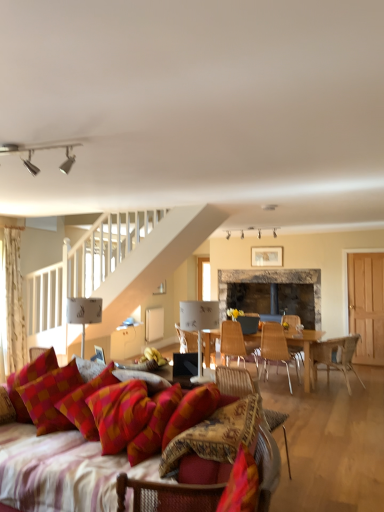
The width and height of the screenshot is (384, 512). What do you see at coordinates (41, 149) in the screenshot?
I see `silver metallic track lights at upper center, the 2th lamp viewed from the right` at bounding box center [41, 149].

This screenshot has height=512, width=384. I want to click on wooden chair at center, the fifth chair from the front, so click(x=235, y=341).

What do you see at coordinates (366, 305) in the screenshot? The height and width of the screenshot is (512, 384). I see `light brown wooden door at right` at bounding box center [366, 305].

Measure the distance between point (76,309) and camera.

Point (76,309) is 3.58 meters from camera.

What is the approximate height of plush fabric couch at lower left?

plush fabric couch at lower left is 28.42 inches in height.

The width and height of the screenshot is (384, 512). I want to click on silver metallic track lights at upper center, placed as the 3th lamp when sorted from back to front, so click(41, 149).

Considering the positions of objects rustic stone fireplace at center and wooden chair at center, the fifth chair from the front, in the image provided, who is more to the right, rustic stone fireplace at center or wooden chair at center, the fifth chair from the front,?

rustic stone fireplace at center is more to the right.

Who is taller, rustic stone fireplace at center or wooden chair at center, the fifth chair from the front?

rustic stone fireplace at center is taller.

What are the coordinates of `fireplace above the wooden chair at center, which is the second chair from back to front (from a real-world perspective)` in the screenshot? It's located at (269, 293).

Is rustic stone fireplace at center inside the boundaries of wooden chair at center, which is the second chair from back to front, or outside?

rustic stone fireplace at center is located beyond the bounds of wooden chair at center, which is the second chair from back to front.

Is white textured curtain at left inside white paper lampshade at upper left, the 1th lamp positioned from the back?

No, white textured curtain at left is not a part of white paper lampshade at upper left, the 1th lamp positioned from the back.

Looking at this image, can you confirm if white paper lampshade at upper left, the third lamp when ordered from front to back, is taller than white textured curtain at left?

No.

From the picture: From a real-world perspective, is white paper lampshade at upper left, which is the third lamp from right to left, beneath white textured curtain at left?

Yes, from a real-world perspective, white paper lampshade at upper left, which is the third lamp from right to left, is below white textured curtain at left.

How many degrees apart are the facing directions of white paper lampshade at upper left, the first lamp in the bottom-to-top sequence, and white textured curtain at left?

They differ by 86.9 degrees in their facing directions.

Is white paper lampshade at upper left, which is the third lamp from right to left, smaller than wooden chair at right, which appears as the 4th chair when viewed from the back?

Yes, white paper lampshade at upper left, which is the third lamp from right to left, is smaller than wooden chair at right, which appears as the 4th chair when viewed from the back.

From the image's perspective, is white paper lampshade at upper left, the third lamp from the top, located above or below wooden chair at right, which appears as the 3th chair when viewed from the front?

Based on their image positions, white paper lampshade at upper left, the third lamp from the top, is located above wooden chair at right, which appears as the 3th chair when viewed from the front.

How far apart are white paper lampshade at upper left, the first lamp in the bottom-to-top sequence, and wooden chair at right, which appears as the 3th chair when viewed from the front?

A distance of 3.49 meters exists between white paper lampshade at upper left, the first lamp in the bottom-to-top sequence, and wooden chair at right, which appears as the 3th chair when viewed from the front.

Is white paper lampshade at upper left, the 1th lamp positioned from the back, wider or thinner than wooden chair at right, which appears as the 4th chair when viewed from the back?

In the image, white paper lampshade at upper left, the 1th lamp positioned from the back, appears to be more narrow than wooden chair at right, which appears as the 4th chair when viewed from the back.

Considering the relative sizes of wooden chair at center, positioned as the 4th chair in front-to-back order, and rustic stone fireplace at center in the image provided, is wooden chair at center, positioned as the 4th chair in front-to-back order, bigger than rustic stone fireplace at center?

No.

In terms of width, does wooden chair at center, placed as the 3th chair when sorted from back to front, look wider or thinner when compared to rustic stone fireplace at center?

In the image, wooden chair at center, placed as the 3th chair when sorted from back to front, appears to be more narrow than rustic stone fireplace at center.

Consider the image. Is wooden chair at center, placed as the 3th chair when sorted from back to front, looking in the opposite direction of rustic stone fireplace at center?

No, wooden chair at center, placed as the 3th chair when sorted from back to front, is not facing the opposite direction of rustic stone fireplace at center.

From a real-world perspective, is wooden chair at center, positioned as the 4th chair in front-to-back order, on top of rustic stone fireplace at center?

No, from a real-world perspective, wooden chair at center, positioned as the 4th chair in front-to-back order, is not on top of rustic stone fireplace at center.

Based on the photo, from the image's perspective, which is above, red checkered pillow at lower left or wooden table at center?

red checkered pillow at lower left is shown above in the image.

Based on their sizes in the image, would you say red checkered pillow at lower left is bigger or smaller than wooden table at center?

Clearly, red checkered pillow at lower left is smaller in size than wooden table at center.

Is there a large distance between red checkered pillow at lower left and wooden table at center?

Yes, red checkered pillow at lower left is far from wooden table at center.

Between red checkered pillow at lower left and wooden table at center, which one appears on the left side from the viewer's perspective?

red checkered pillow at lower left is more to the left.

Looking at this image, can you confirm if plush fabric couch at lower left is smaller than wooden chair at center, which ranks as the first chair in back-to-front order?

Incorrect, plush fabric couch at lower left is not smaller in size than wooden chair at center, which ranks as the first chair in back-to-front order.

Consider the image. Can you tell me how much plush fabric couch at lower left and wooden chair at center, which ranks as the first chair in back-to-front order, differ in facing direction?

2.88 degrees.

Find the location of a particular element. studio couch lying on the left of wooden chair at center, the 6th chair positioned from the front is located at coordinates (52, 467).

Is plush fabric couch at lower left far from wooden chair at center, the 6th chair positioned from the front?

plush fabric couch at lower left is positioned a significant distance from wooden chair at center, the 6th chair positioned from the front.

How many degrees apart are the facing directions of rustic stone fireplace at center and plush fabric couch at lower left?

The angle between the facing direction of rustic stone fireplace at center and the facing direction of plush fabric couch at lower left is 0.154 degrees.

Is rustic stone fireplace at center positioned beyond the bounds of plush fabric couch at lower left?

Indeed, rustic stone fireplace at center is completely outside plush fabric couch at lower left.

In the image, is rustic stone fireplace at center positioned in front of or behind plush fabric couch at lower left?

rustic stone fireplace at center is behind plush fabric couch at lower left.

Considering the points (276, 269) and (271, 414), which point is behind, point (276, 269) or point (271, 414)?

The point (276, 269) is farther.

At what (x,y) coordinates should I click in order to perform the action: click on the 2nd chair in front of the rustic stone fireplace at center, counting from the anchor's position. Please return your answer as a coordinate pair (x, y). This screenshot has height=512, width=384. Looking at the image, I should click on (235, 341).

There is a white textured curtain at left. In order to click on the 2nd lamp below it (from a real-world perspective) in this screenshot , I will do 83,314.

Considering their positions, is light brown wooden door at right positioned closer to plush fabric couch at lower left than red checkered pillow at lower left?

Among the two, red checkered pillow at lower left is located nearer to plush fabric couch at lower left.

Based on their spatial positions, is wooden chair at center, which is the second chair from back to front, or white textured curtain at left further from wooden chair at right, which appears as the 4th chair when viewed from the back?

white textured curtain at left is positioned further to the anchor wooden chair at right, which appears as the 4th chair when viewed from the back.

Considering their positions, is wooden chair at center, which is the second chair from back to front, positioned further to wooden chair at center, which ranks as the first chair in back-to-front order, than red checkered pillow at lower left?

red checkered pillow at lower left is positioned further to the anchor wooden chair at center, which ranks as the first chair in back-to-front order.

Considering their positions, is white textured curtain at left positioned closer to wooden chair at right, which appears as the 3th chair when viewed from the front, than wooden table at center?

Among the two, wooden table at center is located nearer to wooden chair at right, which appears as the 3th chair when viewed from the front.

From the image, which object appears to be nearer to rustic stone fireplace at center, silver metallic track lights at upper center, the third lamp from the bottom, or wooden chair at center, which is the second chair from back to front?

wooden chair at center, which is the second chair from back to front, lies closer to rustic stone fireplace at center than the other object.

From the image, which object appears to be nearer to wooden table at center, white paper lampshade at upper left, which is the third lamp from right to left, or wooden chair at right, which appears as the 3th chair when viewed from the front?

wooden chair at right, which appears as the 3th chair when viewed from the front.

Based on their spatial positions, is white paper lampshade at center, the third lamp viewed from the left, or textured woven chair at lower left, the first chair viewed from the front, further from wooden chair at center, placed as the 3th chair when sorted from back to front?

textured woven chair at lower left, the first chair viewed from the front, is positioned further to the anchor wooden chair at center, placed as the 3th chair when sorted from back to front.

Looking at the image, which one is located further to white paper lampshade at upper left, the third lamp when ordered from front to back, wooden chair at center, positioned as the 4th chair in front-to-back order, or rustic stone fireplace at center?

rustic stone fireplace at center.

The width and height of the screenshot is (384, 512). Find the location of `kitchen & dining room table located between white paper lampshade at upper left, the third lamp from the top, and wooden chair at center, the 6th chair positioned from the front, in the depth direction`. kitchen & dining room table located between white paper lampshade at upper left, the third lamp from the top, and wooden chair at center, the 6th chair positioned from the front, in the depth direction is located at coordinates (304, 348).

At what (x,y) coordinates should I click in order to perform the action: click on kitchen & dining room table between white paper lampshade at center, positioned as the second lamp in back-to-front order, and wooden chair at center, the fifth chair from the front, in the front-back direction. Please return your answer as a coordinate pair (x, y). This screenshot has height=512, width=384. Looking at the image, I should click on click(304, 348).

At what (x,y) coordinates should I click in order to perform the action: click on curtain positioned between textured woven chair at lower left, the first chair viewed from the front, and rustic stone fireplace at center from near to far. Please return your answer as a coordinate pair (x, y). The image size is (384, 512). Looking at the image, I should click on (13, 303).

The width and height of the screenshot is (384, 512). Find the location of `studio couch between textured woven chair at lower left, the sixth chair when ordered from back to front, and wooden table at center from front to back`. studio couch between textured woven chair at lower left, the sixth chair when ordered from back to front, and wooden table at center from front to back is located at coordinates (52, 467).